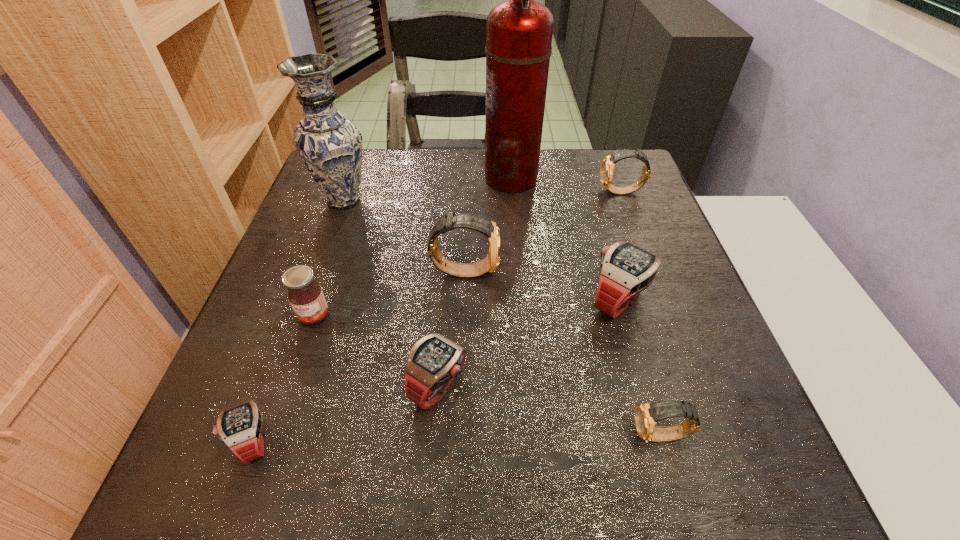
You are a GUI agent. You are given a task and a screenshot of the screen. Output one action in this format:
    pyautogui.click(x=<x>, y=<y>)
    Task: Click on the vacant space at the far edge of the desktop
    The height and width of the screenshot is (540, 960).
    Given the screenshot: What is the action you would take?
    pyautogui.click(x=375, y=193)

In the image, there is a desktop. At what (x,y) coordinates should I click in order to perform the action: click on free space at the near edge. Please return your answer as a coordinate pair (x, y). Looking at the image, I should click on (602, 480).

In the image, there is a desktop. In order to click on free region at the left edge in this screenshot , I will do `click(265, 347)`.

The height and width of the screenshot is (540, 960). In the image, there is a desktop. What are the coordinates of `vacant area at the right edge` in the screenshot? It's located at (623, 228).

The height and width of the screenshot is (540, 960). Find the location of `free location at the far right corner of the desktop`. free location at the far right corner of the desktop is located at coordinates (641, 197).

In the image, there is a desktop. Identify the location of vacant space at the near right corner. The height and width of the screenshot is (540, 960). (715, 491).

Locate an element on the screen. The width and height of the screenshot is (960, 540). free space between the shortest watch and the jam is located at coordinates (284, 378).

Locate an element on the screen. The height and width of the screenshot is (540, 960). free space that is in between the smallest gold watch and the second red watch from left to right is located at coordinates (550, 411).

Where is `vacant area between the smallest gold watch and the second red watch from right to left`? The image size is (960, 540). vacant area between the smallest gold watch and the second red watch from right to left is located at coordinates (550, 411).

This screenshot has height=540, width=960. What are the coordinates of `vacant space in between the jam and the shortest watch` in the screenshot? It's located at (284, 378).